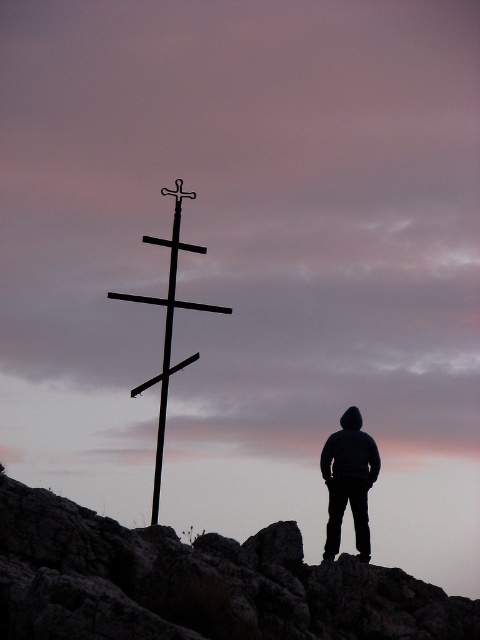
You are a photographer trying to capture the rugged stone rock at center and the black metal cross at center in a single frame. Since you want both objects to be clearly visible, which object should you ensure is closer to the camera to avoid blurring due to their size difference?

The rugged stone rock at center has a lesser width compared to the black metal cross at center. To ensure both are clearly visible without blurring, position the rugged stone rock at center closer to the camera so its smaller size is compensated by proximity, while the black metal cross at center can be slightly farther but still within focus range.